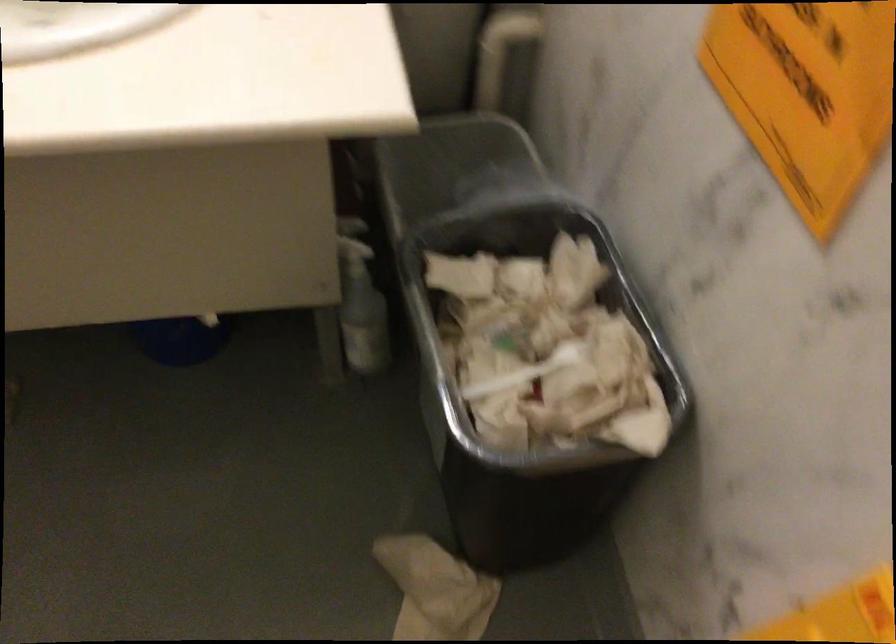
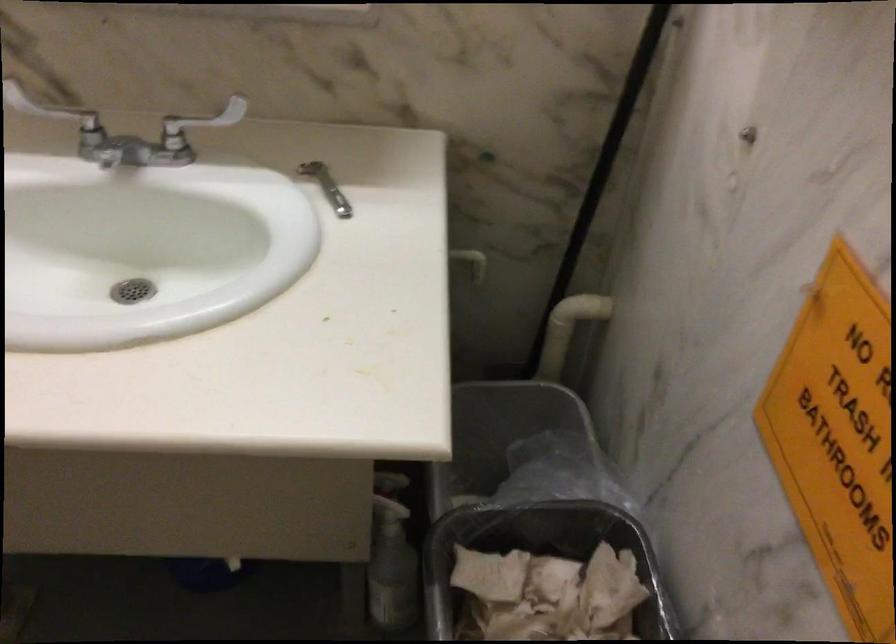
Question: The images are taken continuously from a first-person perspective. In which direction is your viewpoint rotating?

Choices:
 (A) Left
 (B) Right
 (C) Up
 (D) Down

Answer: (C)